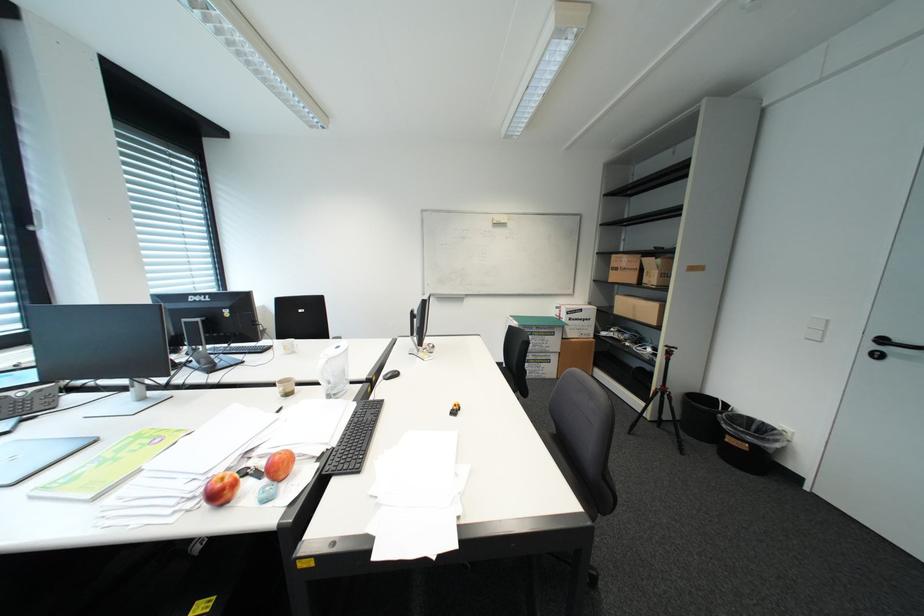
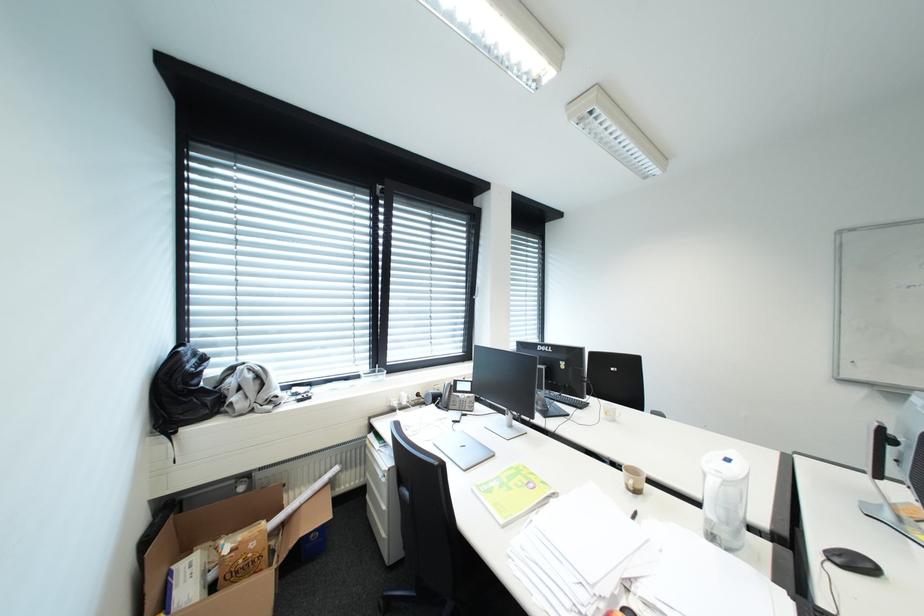
Question: The camera is either moving clockwise (left) or counter-clockwise (right) around the object. The first image is from the beginning of the video and the second image is from the end. Is the camera moving left or right when shooting the video?

Choices:
 (A) Left
 (B) Right

Answer: (B)